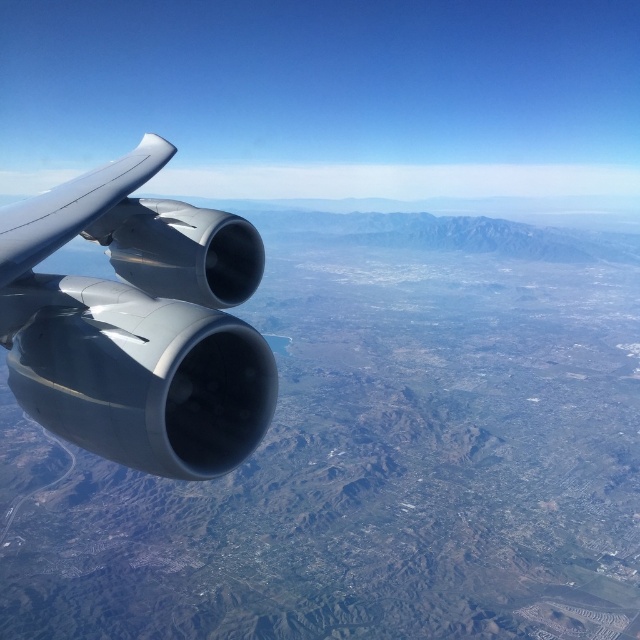
You are a passenger on the plane and notice the matte gray engine at left and the satin silver wing at upper left. Which object is positioned lower in the image?

The matte gray engine at left is positioned below the satin silver wing at upper left, so it is lower in the image.

You are a flight attendant checking the aircraft components from the window. You need to confirm if the matte gray engine at left is wider than the satin silver wing at upper left. Based on your observation, what is your conclusion?

The matte gray engine at left is narrower than the satin silver wing at upper left because the matte gray engine at left has a smaller width compared to the satin silver wing at upper left.

You are a flight attendant who notices two objects outside the airplane window. You need to determine their positions relative to each other. Which object is closer to the airplane cabin? Please choose between the matte gray engine at left and the satin silver wing at upper left.

The matte gray engine at left is closer to the airplane cabin because it is positioned in front of the satin silver wing at upper left, meaning it is nearer to the observer inside the cabin.